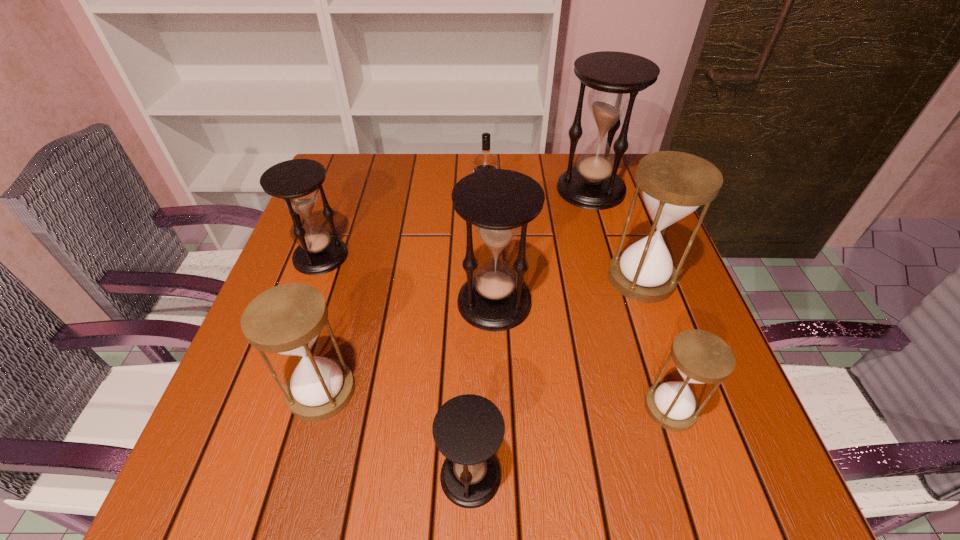
Identify which hourglass is the fifth closest to the third smallest black hourglass. Please provide its 2D coordinates. Your answer should be formatted as a tuple, i.e. [(x, y)], where the tuple contains the x and y coordinates of a point satisfying the conditions above.

[(616, 78)]

Find the location of a particular element. The image size is (960, 540). the closest black hourglass to the second smallest black hourglass is located at coordinates (498, 202).

Identify which black hourglass is the second closest to the tallest hourglass. Please provide its 2D coordinates. Your answer should be formatted as a tuple, i.e. [(x, y)], where the tuple contains the x and y coordinates of a point satisfying the conditions above.

[(295, 181)]

Identify which white hourglass is located as the nearest to the farthest hourglass. Please provide its 2D coordinates. Your answer should be formatted as a tuple, i.e. [(x, y)], where the tuple contains the x and y coordinates of a point satisfying the conditions above.

[(674, 184)]

Find the location of `white hourglass that is the second closest to the smallest black hourglass`. white hourglass that is the second closest to the smallest black hourglass is located at coordinates (701, 357).

I want to click on free location that satisfies the following two spatial constraints: 1. on the label of the vodka; 2. on the back side of the second biggest black hourglass, so [487, 302].

This screenshot has height=540, width=960. I want to click on free spot that satisfies the following two spatial constraints: 1. on the label of the vodka; 2. on the front side of the leftmost white hourglass, so click(x=488, y=391).

This screenshot has width=960, height=540. What are the coordinates of `free space that satisfies the following two spatial constraints: 1. on the front side of the smallest black hourglass; 2. on the right side of the leftmost white hourglass` in the screenshot? It's located at (299, 476).

The height and width of the screenshot is (540, 960). Identify the location of free point that satisfies the following two spatial constraints: 1. on the front side of the third smallest black hourglass; 2. on the right side of the leftmost black hourglass. (304, 302).

Locate an element on the screen. This screenshot has height=540, width=960. vacant region that satisfies the following two spatial constraints: 1. on the label of the vodka; 2. on the back side of the third smallest black hourglass is located at coordinates (487, 302).